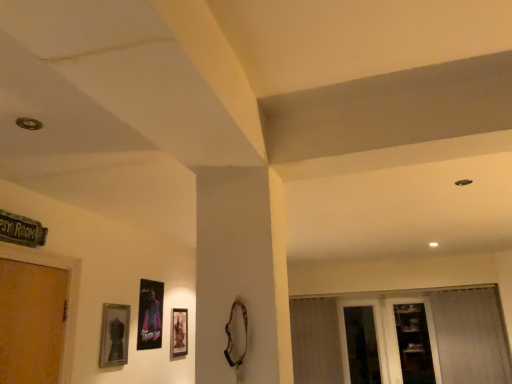
Question: Is wooden shelf at lower right further to the viewer compared to white sheer curtain at right?

Choices:
 (A) no
 (B) yes

Answer: (B)

Question: Can we say wooden shelf at lower right lies outside white sheer curtain at right?

Choices:
 (A) no
 (B) yes

Answer: (B)

Question: Is white sheer curtain at right surrounded by wooden shelf at lower right?

Choices:
 (A) no
 (B) yes

Answer: (A)

Question: From a real-world perspective, is wooden shelf at lower right over white sheer curtain at right?

Choices:
 (A) no
 (B) yes

Answer: (A)

Question: Can you confirm if wooden shelf at lower right is positioned to the right of white sheer curtain at right?

Choices:
 (A) no
 (B) yes

Answer: (A)

Question: Does wooden shelf at lower right have a lesser height compared to white sheer curtain at right?

Choices:
 (A) no
 (B) yes

Answer: (B)

Question: Is transparent glass door at lower right facing towards matte silver picture frame at lower left, acting as the first picture frame starting from the left?

Choices:
 (A) no
 (B) yes

Answer: (B)

Question: Does transparent glass door at lower right appear on the right side of matte silver picture frame at lower left, acting as the first picture frame starting from the left?

Choices:
 (A) yes
 (B) no

Answer: (A)

Question: Is transparent glass door at lower right directly adjacent to matte silver picture frame at lower left, the 1th picture frame when ordered from front to back?

Choices:
 (A) yes
 (B) no

Answer: (B)

Question: From a real-world perspective, is transparent glass door at lower right over matte silver picture frame at lower left, acting as the first picture frame starting from the left?

Choices:
 (A) no
 (B) yes

Answer: (A)

Question: Does transparent glass door at lower right have a greater height compared to matte silver picture frame at lower left, the 1th picture frame when ordered from front to back?

Choices:
 (A) no
 (B) yes

Answer: (B)

Question: Can you confirm if transparent glass door at lower right is positioned to the left of matte silver picture frame at lower left, the 3th picture frame positioned from the right?

Choices:
 (A) no
 (B) yes

Answer: (A)

Question: Is wooden shelf at lower right closer to the viewer compared to transparent glass door at lower right?

Choices:
 (A) yes
 (B) no

Answer: (A)